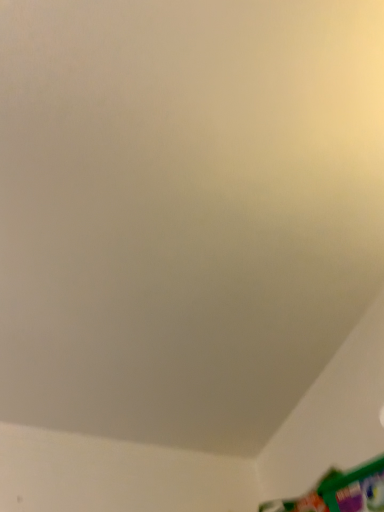
The image size is (384, 512). What do you see at coordinates (339, 492) in the screenshot? I see `green plastic toy at lower right` at bounding box center [339, 492].

Where is `green plastic toy at lower right`? green plastic toy at lower right is located at coordinates (339, 492).

The image size is (384, 512). Find the location of `green plastic toy at lower right`. green plastic toy at lower right is located at coordinates (339, 492).